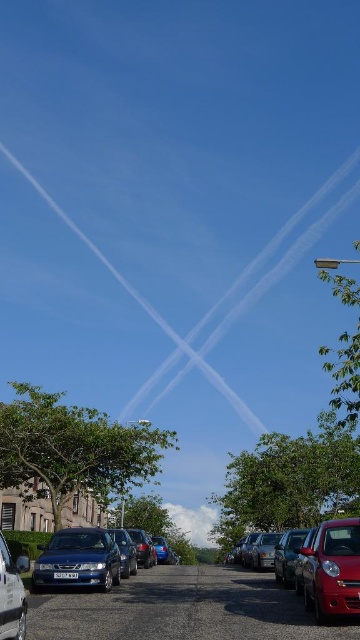
Based on the photo, can you confirm if metallic blue sedan at lower left is positioned above metallic blue sedan at center?

Actually, metallic blue sedan at lower left is below metallic blue sedan at center.

Does metallic blue sedan at lower left have a larger size compared to metallic blue sedan at center?

Indeed, metallic blue sedan at lower left has a larger size compared to metallic blue sedan at center.

Which is in front, point (69, 545) or point (131, 572)?

Point (69, 545) is in front.

I want to click on metallic blue sedan at lower left, so click(x=78, y=561).

Between metallic gray cars at lower left and metallic silver car at lower left, which one is positioned lower?

metallic gray cars at lower left is below.

Is metallic gray cars at lower left to the left of metallic silver car at lower left from the viewer's perspective?

In fact, metallic gray cars at lower left is to the right of metallic silver car at lower left.

You are a GUI agent. You are given a task and a screenshot of the screen. Output one action in this format:
    pyautogui.click(x=<x>, y=<y>)
    Task: Click on the metallic gray cars at lower left
    Image resolution: width=360 pixels, height=640 pixels.
    Given the screenshot: What is the action you would take?
    pyautogui.click(x=181, y=609)

The image size is (360, 640). What are the coordinates of `metallic gray cars at lower left` in the screenshot? It's located at (181, 609).

Who is higher up, metallic gray cars at lower left or shiny red car at lower right?

shiny red car at lower right is above.

Which is more to the left, metallic gray cars at lower left or shiny red car at lower right?

metallic gray cars at lower left

In order to click on metallic gray cars at lower left in this screenshot , I will do `click(181, 609)`.